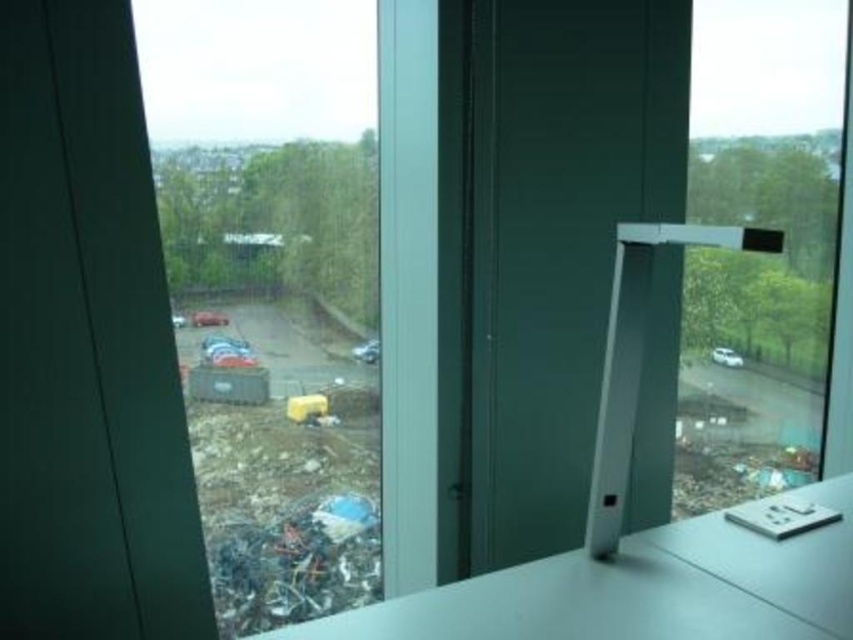
Can you confirm if transparent glass window at right is shorter than white glossy table at lower right?

No, transparent glass window at right is not shorter than white glossy table at lower right.

Which is more to the right, transparent glass window at right or white glossy table at lower right?

transparent glass window at right

Is point (751, 42) positioned before point (848, 576)?

No, (751, 42) is behind (848, 576).

Locate an element on the screen. This screenshot has height=640, width=853. transparent glass window at right is located at coordinates (759, 257).

Is transparent glass window at center smaller than white glossy counter top at center?

Actually, transparent glass window at center might be larger than white glossy counter top at center.

Does point (181, 177) come closer to viewer compared to point (743, 529)?

No.

Locate an element on the screen. Image resolution: width=853 pixels, height=640 pixels. transparent glass window at center is located at coordinates (271, 291).

At what (x,y) coordinates should I click in order to perform the action: click on transparent glass window at center. Please return your answer as a coordinate pair (x, y). Looking at the image, I should click on (271, 291).

Is transparent glass window at center taller than transparent glass window at right?

No, transparent glass window at center is not taller than transparent glass window at right.

Does transparent glass window at center appear on the right side of transparent glass window at right?

Incorrect, transparent glass window at center is not on the right side of transparent glass window at right.

The image size is (853, 640). Describe the element at coordinates (271, 291) in the screenshot. I see `transparent glass window at center` at that location.

Find the location of a particular element. The height and width of the screenshot is (640, 853). transparent glass window at center is located at coordinates (271, 291).